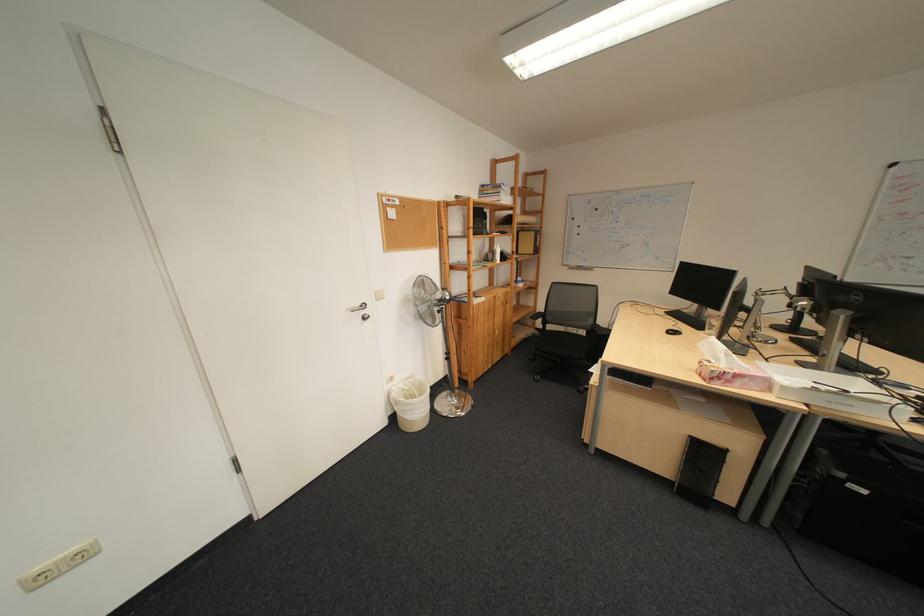
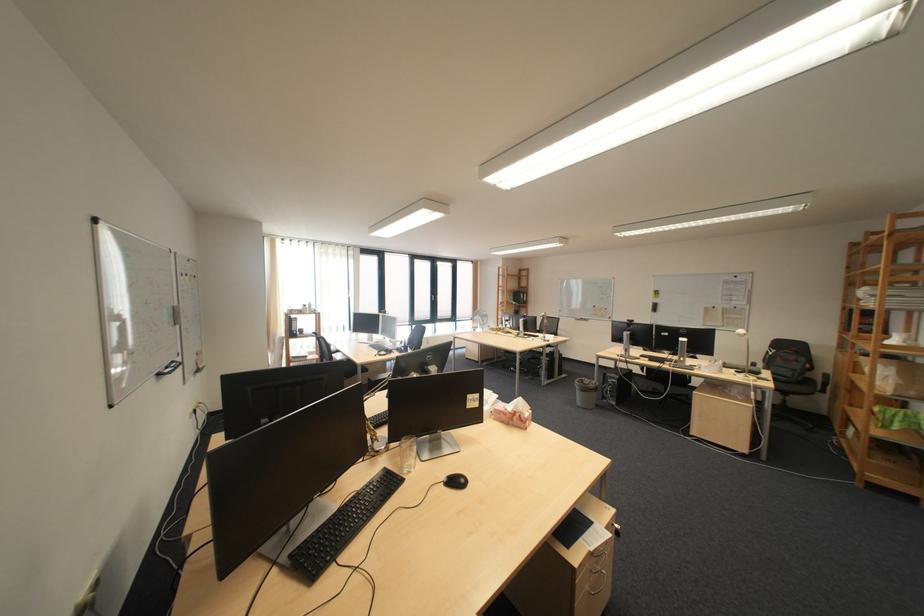
Question: I am providing you with two images of the same scene from different viewpoints. After the viewpoint changes to image2, which objects are now occluded?

Choices:
 (A) tissue box
 (B) pink tissue box
 (C) drawer lock
 (D) black scoring bead

Answer: (A)